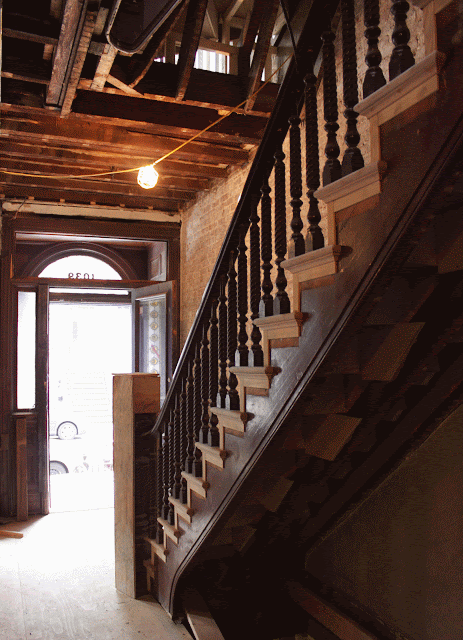
I want to click on window, so click(78, 260), click(26, 347).